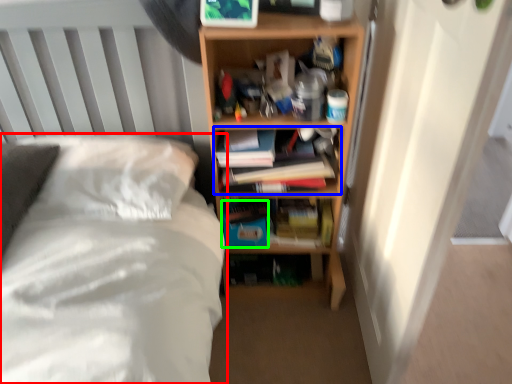
Question: Estimate the real-world distances between objects in this image. Which object is closer to bed (highlighted by a red box), book (highlighted by a blue box) or paperback book (highlighted by a green box)?

Choices:
 (A) book
 (B) paperback book

Answer: (A)